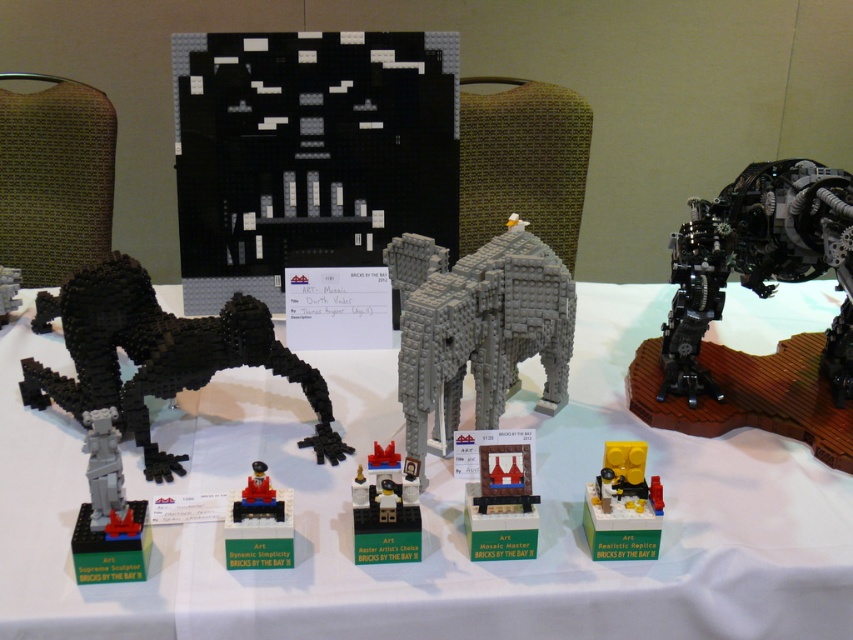
You are a photographer standing behind the table. You want to take a photo of both the black matte lego sculpture at center and the matte gray statue at center. Which one will appear larger in the photo?

The black matte lego sculpture at center will appear larger in the photo because it is closer to the viewer than the matte gray statue at center.